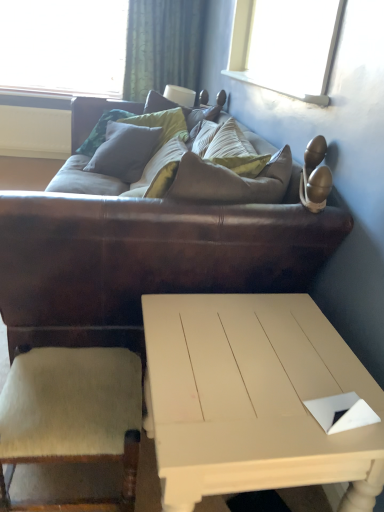
You are a GUI agent. You are given a task and a screenshot of the screen. Output one action in this format:
    pyautogui.click(x=<x>, y=<y>)
    Task: Click on the vacant point above white painted wood coffee table at lower center (from a real-world perspective)
    
    Given the screenshot: What is the action you would take?
    tap(257, 362)